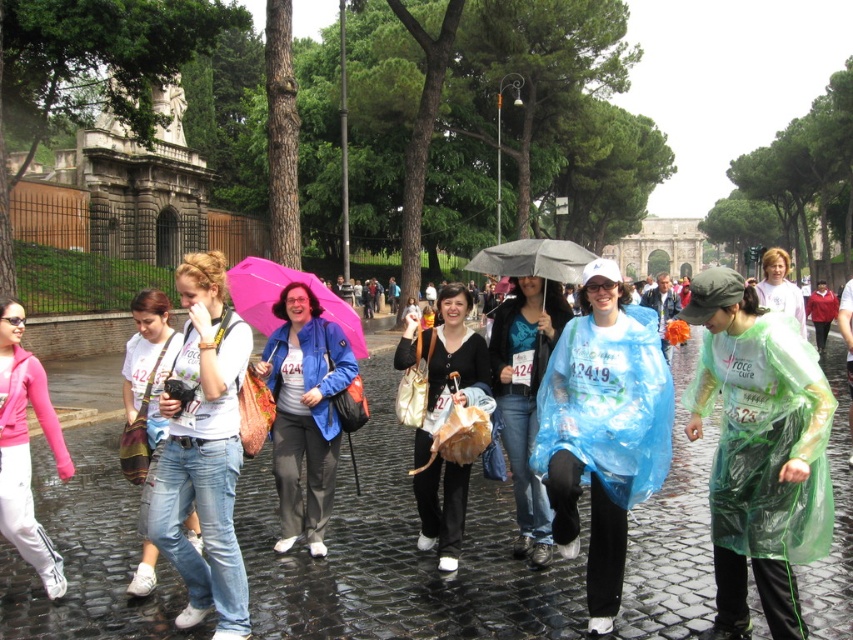
Which is below, cobblestone pavement at center or pink fleece jacket at lower left?

cobblestone pavement at center is below.

Who is positioned more to the left, cobblestone pavement at center or pink fleece jacket at lower left?

Positioned to the left is pink fleece jacket at lower left.

Does point (619, 632) lie behind point (1, 468)?

No.

Locate an element on the screen. This screenshot has height=640, width=853. cobblestone pavement at center is located at coordinates (x=398, y=552).

Does blue translucent raincoat at center lie in front of jeans at center?

No, it is behind jeans at center.

Looking at this image, who is positioned more to the left, blue translucent raincoat at center or jeans at center?

From the viewer's perspective, jeans at center appears more on the left side.

Describe the element at coordinates (602, 432) in the screenshot. I see `blue translucent raincoat at center` at that location.

This screenshot has width=853, height=640. In order to click on blue translucent raincoat at center in this screenshot , I will do click(602, 432).

Is black matte jacket at center positioned before translucent blue raincoat at center?

Yes, it is.

Which is behind, point (454, 378) or point (567, 317)?

The point (567, 317) is behind.

Where is `black matte jacket at center`? The width and height of the screenshot is (853, 640). black matte jacket at center is located at coordinates (445, 364).